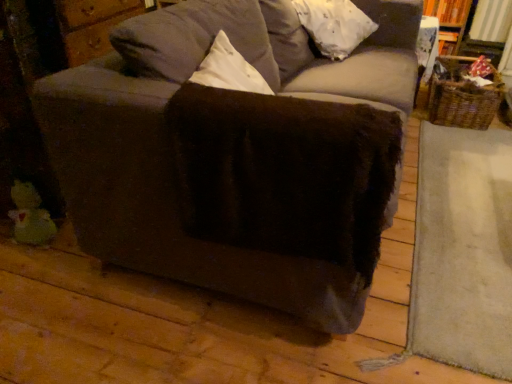
You are a GUI agent. You are given a task and a screenshot of the screen. Output one action in this format:
    pyautogui.click(x=<x>, y=<y>)
    Task: Click on the woven brown basket at right
    Image resolution: width=512 pixels, height=384 pixels.
    Given the screenshot: What is the action you would take?
    pyautogui.click(x=463, y=95)

Find the location of `velvet gray couch at center`. velvet gray couch at center is located at coordinates (237, 157).

I want to click on green plush duck at lower left, so click(x=30, y=216).

You are a GUI agent. You are given a task and a screenshot of the screen. Output one action in this format:
    pyautogui.click(x=<x>, y=<y>)
    Task: Click on the white fluffy pillow at upper center
    
    Given the screenshot: What is the action you would take?
    pyautogui.click(x=334, y=25)

Considering the relative positions of velvet gray couch at center and woven brown basket at right in the image provided, is velvet gray couch at center to the left or to the right of woven brown basket at right?

Based on their positions, velvet gray couch at center is located to the left of woven brown basket at right.

Is there a large distance between velvet gray couch at center and woven brown basket at right?

That's right, there is a large distance between velvet gray couch at center and woven brown basket at right.

Where is `basket on the right of velvet gray couch at center`? The image size is (512, 384). basket on the right of velvet gray couch at center is located at coordinates (463, 95).

Between velvet gray couch at center and woven brown basket at right, which one has smaller width?

With smaller width is woven brown basket at right.

Who is more distant, woven brown basket at right or green plush duck at lower left?

woven brown basket at right.

Which object is positioned more to the right, woven brown basket at right or green plush duck at lower left?

Positioned to the right is woven brown basket at right.

Considering the sizes of objects woven brown basket at right and green plush duck at lower left in the image provided, who is thinner, woven brown basket at right or green plush duck at lower left?

green plush duck at lower left.

Looking at this image, from the image's perspective, is woven brown basket at right located above or below white fluffy pillow at upper center?

woven brown basket at right is situated lower than white fluffy pillow at upper center in the image.

Is woven brown basket at right aimed at white fluffy pillow at upper center?

No, woven brown basket at right does not turn towards white fluffy pillow at upper center.

Is point (478, 121) more distant than point (362, 31)?

Yes, it is behind point (362, 31).

Looking at this image, could you tell me if woven brown basket at right is turned towards velvet gray couch at center?

No, woven brown basket at right is not aimed at velvet gray couch at center.

From a real-world perspective, which is physically below, woven brown basket at right or velvet gray couch at center?

In real-world perspective, woven brown basket at right is lower.

Visually, is woven brown basket at right positioned to the left or to the right of velvet gray couch at center?

Clearly, woven brown basket at right is on the right of velvet gray couch at center in the image.

Find the location of a particular element. studio couch below the woven brown basket at right (from the image's perspective) is located at coordinates (237, 157).

Is white fluffy pillow at upper center looking in the opposite direction of velvet gray couch at center?

Absolutely, white fluffy pillow at upper center is directed away from velvet gray couch at center.

Considering their positions, is white fluffy pillow at upper center located in front of or behind velvet gray couch at center?

white fluffy pillow at upper center is behind velvet gray couch at center.

Is white fluffy pillow at upper center at the right side of velvet gray couch at center?

Yes.

Is white fluffy pillow at upper center not within velvet gray couch at center?

No, white fluffy pillow at upper center is inside velvet gray couch at center's boundary.

Does velvet gray couch at center have a greater height compared to green plush duck at lower left?

Yes, velvet gray couch at center is taller than green plush duck at lower left.

How different are the orientations of velvet gray couch at center and green plush duck at lower left in degrees?

There is a 67.7-degree angle between the facing directions of velvet gray couch at center and green plush duck at lower left.

Considering the positions of objects velvet gray couch at center and green plush duck at lower left in the image provided, who is more to the right, velvet gray couch at center or green plush duck at lower left?

velvet gray couch at center is more to the right.

Which object is positioned more to the right, velvet gray couch at center or white fluffy pillow at upper center?

Positioned to the right is white fluffy pillow at upper center.

From a real-world perspective, is velvet gray couch at center physically above white fluffy pillow at upper center?

No.

From the image's perspective, which is above, velvet gray couch at center or white fluffy pillow at upper center?

white fluffy pillow at upper center, from the image's perspective.

The image size is (512, 384). In the image, there is a woven brown basket at right. In order to click on studio couch below it (from the image's perspective) in this screenshot , I will do `click(237, 157)`.

Locate an element on the screen. The width and height of the screenshot is (512, 384). basket on the right of green plush duck at lower left is located at coordinates (463, 95).

In the scene shown: Based on their spatial positions, is velvet gray couch at center or green plush duck at lower left further from woven brown basket at right?

green plush duck at lower left.

Estimate the real-world distances between objects in this image. Which object is closer to white fluffy pillow at upper center, green plush duck at lower left or woven brown basket at right?

woven brown basket at right is closer to white fluffy pillow at upper center.

From the image, which object appears to be farther from white fluffy pillow at upper center, woven brown basket at right or green plush duck at lower left?

Result: green plush duck at lower left lies further to white fluffy pillow at upper center than the other object.

Looking at the image, which one is located closer to white fluffy pillow at upper center, woven brown basket at right or velvet gray couch at center?

Among the two, woven brown basket at right is located nearer to white fluffy pillow at upper center.

Looking at the image, which one is located closer to velvet gray couch at center, woven brown basket at right or green plush duck at lower left?

The object closer to velvet gray couch at center is green plush duck at lower left.

Which object lies further to the anchor point white fluffy pillow at upper center, velvet gray couch at center or woven brown basket at right?

velvet gray couch at center is further to white fluffy pillow at upper center.

When comparing their distances from velvet gray couch at center, does green plush duck at lower left or white fluffy pillow at upper center seem further?

green plush duck at lower left.

Based on their spatial positions, is green plush duck at lower left or velvet gray couch at center closer to woven brown basket at right?

velvet gray couch at center.

This screenshot has width=512, height=384. I want to click on studio couch situated between green plush duck at lower left and woven brown basket at right from left to right, so click(x=237, y=157).

The width and height of the screenshot is (512, 384). I want to click on studio couch located between green plush duck at lower left and white fluffy pillow at upper center in the left-right direction, so click(237, 157).

At what (x,y) coordinates should I click in order to perform the action: click on pillow between green plush duck at lower left and woven brown basket at right in the horizontal direction. Please return your answer as a coordinate pair (x, y). Looking at the image, I should click on (334, 25).

This screenshot has width=512, height=384. I want to click on pillow located between velvet gray couch at center and woven brown basket at right in the depth direction, so click(334, 25).